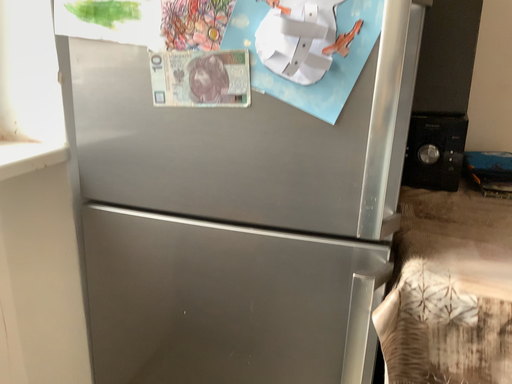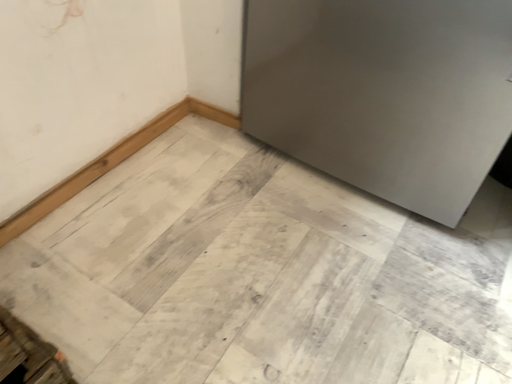
Question: How did the camera likely rotate when shooting the video?

Choices:
 (A) rotated downward
 (B) rotated upward

Answer: (A)